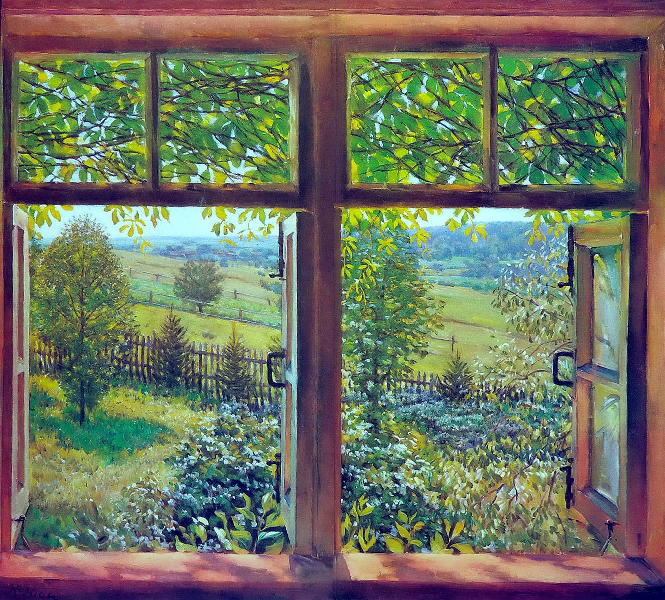
Locate an element on the screen. This screenshot has width=665, height=600. black hook is located at coordinates (606, 536), (25, 535).